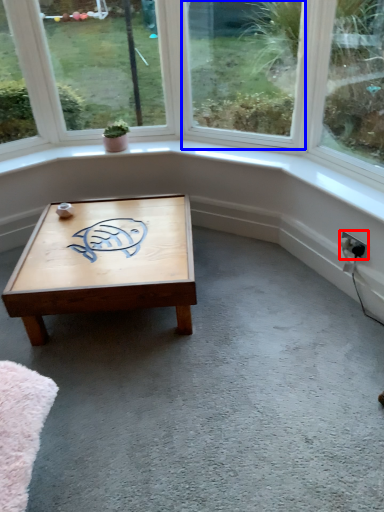
Question: Which of the following is the closest to the observer, electric outlet (highlighted by a red box) or window (highlighted by a blue box)?

Choices:
 (A) electric outlet
 (B) window

Answer: (B)